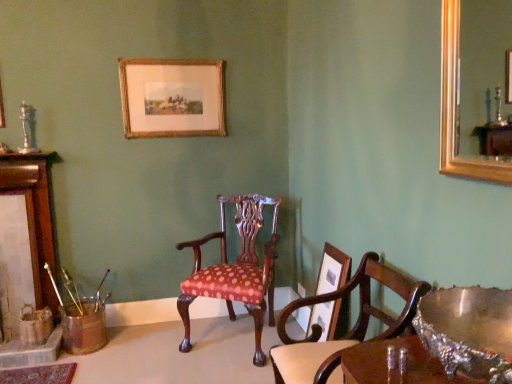
Measure the distance between point (447, 321) and camera.

Point (447, 321) is 3.81 feet from camera.

In order to click on shiny silver bowl at lower right in this screenshot , I will do `click(468, 331)`.

Based on the photo, is polka dot fabric chair at center, which ranks as the 1th chair in back-to-front order, looking in the opposite direction of brushed metal fireplace at left?

No, polka dot fabric chair at center, which ranks as the 1th chair in back-to-front order, is not facing away from brushed metal fireplace at left.

Is polka dot fabric chair at center, the 2th chair from the front, spatially inside brushed metal fireplace at left, or outside of it?

polka dot fabric chair at center, the 2th chair from the front, lies outside brushed metal fireplace at left.

Which is nearer, (186,350) or (27,179)?

Point (186,350) appears to be closer to the viewer than point (27,179).

Find the location of a particular element. glass bowl above the wooden picture frame at center, placed as the first picture frame when sorted from front to back (from the image's perspective) is located at coordinates (468, 331).

From the image's perspective, which is above, wooden picture frame at center, the second picture frame in the top-to-bottom sequence, or shiny silver bowl at lower right?

shiny silver bowl at lower right, from the image's perspective.

Does wooden picture frame at center, the first picture frame from the bottom, contain shiny silver bowl at lower right?

Definitely not — shiny silver bowl at lower right is not inside wooden picture frame at center, the first picture frame from the bottom.

From a real-world perspective, which object rests below the other?

wooden picture frame at center, arranged as the 2th picture frame when viewed from the left, is physically lower.

From a real-world perspective, relative to brushed metal fireplace at left, is polka dot fabric chair at center, which appears as the 1th chair when viewed from the front, vertically above or below?

From a real-world perspective, polka dot fabric chair at center, which appears as the 1th chair when viewed from the front, is physically below brushed metal fireplace at left.

Does point (325, 362) come farther from viewer compared to point (55, 299)?

No, it is in front of (55, 299).

Is polka dot fabric chair at center, which appears as the 1th chair when viewed from the front, directly adjacent to brushed metal fireplace at left?

No, polka dot fabric chair at center, which appears as the 1th chair when viewed from the front, is not beside brushed metal fireplace at left.

Could you tell me if polka dot fabric chair at center, which appears as the 1th chair when viewed from the front, is turned towards brushed metal fireplace at left?

No, polka dot fabric chair at center, which appears as the 1th chair when viewed from the front, is not turned towards brushed metal fireplace at left.

Is point (317, 313) closer to viewer compared to point (375, 255)?

That is False.

Looking at this image, does wooden picture frame at center, which appears as the second picture frame when viewed from the back, have a lesser width compared to polka dot fabric chair at center, which appears as the 1th chair when viewed from the front?

Yes, wooden picture frame at center, which appears as the second picture frame when viewed from the back, is thinner than polka dot fabric chair at center, which appears as the 1th chair when viewed from the front.

Is wooden picture frame at center, placed as the first picture frame when sorted from front to back, aimed at polka dot fabric chair at center, acting as the 2th chair starting from the back?

No, wooden picture frame at center, placed as the first picture frame when sorted from front to back, is not aimed at polka dot fabric chair at center, acting as the 2th chair starting from the back.

Based on the photo, would you say polka dot fabric chair at center, which appears as the 1th chair when viewed from the front, is a long distance from wooden picture frame at center, the second picture frame in the top-to-bottom sequence?

polka dot fabric chair at center, which appears as the 1th chair when viewed from the front, is near wooden picture frame at center, the second picture frame in the top-to-bottom sequence, not far away.

Could you tell me if polka dot fabric chair at center, which appears as the 1th chair when viewed from the front, is turned towards wooden picture frame at center, the second picture frame in the top-to-bottom sequence?

No, polka dot fabric chair at center, which appears as the 1th chair when viewed from the front, is not facing towards wooden picture frame at center, the second picture frame in the top-to-bottom sequence.

In the scene shown: From a real-world perspective, which object rests below the other?

polka dot fabric chair at center, which appears as the 1th chair when viewed from the front, is physically lower.

Between polka dot fabric chair at center, which appears as the 1th chair when viewed from the front, and wooden picture frame at center, arranged as the 2th picture frame when viewed from the left, which one has smaller width?

Thinner between the two is wooden picture frame at center, arranged as the 2th picture frame when viewed from the left.

Which of these two, polka dot fabric chair at center, which ranks as the 1th chair in back-to-front order, or gold-framed print at upper center, the second picture frame viewed from the right, is thinner?

gold-framed print at upper center, the second picture frame viewed from the right, is thinner.

Which is correct: polka dot fabric chair at center, which ranks as the 1th chair in back-to-front order, is inside gold-framed print at upper center, which is counted as the 1th picture frame, starting from the top, or outside of it?

polka dot fabric chair at center, which ranks as the 1th chair in back-to-front order, exists outside the volume of gold-framed print at upper center, which is counted as the 1th picture frame, starting from the top.

What's the angular difference between polka dot fabric chair at center, which ranks as the 1th chair in back-to-front order, and gold-framed print at upper center, which appears as the 2th picture frame when viewed from the front,'s facing directions?

The facing directions of polka dot fabric chair at center, which ranks as the 1th chair in back-to-front order, and gold-framed print at upper center, which appears as the 2th picture frame when viewed from the front, are 32.2 degrees apart.

From the image's perspective, is polka dot fabric chair at center, the 2th chair from the front, under gold-framed print at upper center, marked as the first picture frame in a left-to-right arrangement?

Yes, from the image's perspective, polka dot fabric chair at center, the 2th chair from the front, is below gold-framed print at upper center, marked as the first picture frame in a left-to-right arrangement.

Considering the sizes of polka dot fabric chair at center, acting as the 2th chair starting from the back, and polka dot fabric chair at center, which ranks as the 1th chair in back-to-front order, in the image, is polka dot fabric chair at center, acting as the 2th chair starting from the back, bigger or smaller than polka dot fabric chair at center, which ranks as the 1th chair in back-to-front order,?

Considering their sizes, polka dot fabric chair at center, acting as the 2th chair starting from the back, takes up less space than polka dot fabric chair at center, which ranks as the 1th chair in back-to-front order.

From a real-world perspective, is polka dot fabric chair at center, which appears as the 1th chair when viewed from the front, physically located above or below polka dot fabric chair at center, the 2th chair from the front?

From a real-world perspective, polka dot fabric chair at center, which appears as the 1th chair when viewed from the front, is physically above polka dot fabric chair at center, the 2th chair from the front.

From the image's perspective, does polka dot fabric chair at center, which appears as the 1th chair when viewed from the front, appear lower than polka dot fabric chair at center, the 2th chair from the front?

Indeed, from the image's perspective, polka dot fabric chair at center, which appears as the 1th chair when viewed from the front, is shown beneath polka dot fabric chair at center, the 2th chair from the front.

How many degrees apart are the facing directions of polka dot fabric chair at center, acting as the 2th chair starting from the back, and polka dot fabric chair at center, which ranks as the 1th chair in back-to-front order?

The angle between the facing direction of polka dot fabric chair at center, acting as the 2th chair starting from the back, and the facing direction of polka dot fabric chair at center, which ranks as the 1th chair in back-to-front order, is 58.4 degrees.

Locate an element on the screen. This screenshot has height=384, width=512. fireplace that appears above the polka dot fabric chair at center, the 2th chair from the front (from the image's perspective) is located at coordinates (26, 252).

Image resolution: width=512 pixels, height=384 pixels. Identify the location of glass bowl that appears above the wooden picture frame at center, the first picture frame from the bottom (from a real-world perspective). [468, 331].

Estimate the real-world distances between objects in this image. Which object is further from polka dot fabric chair at center, the 2th chair from the front, wooden picture frame at center, placed as the first picture frame when sorted from front to back, or brushed metal fireplace at left?

Based on the image, brushed metal fireplace at left appears to be further to polka dot fabric chair at center, the 2th chair from the front.

Estimate the real-world distances between objects in this image. Which object is further from shiny silver bowl at lower right, wooden picture frame at center, arranged as the 2th picture frame when viewed from the left, or gold-framed print at upper center, positioned as the second picture frame in bottom-to-top order?

Based on the image, gold-framed print at upper center, positioned as the second picture frame in bottom-to-top order, appears to be further to shiny silver bowl at lower right.

Estimate the real-world distances between objects in this image. Which object is closer to shiny silver bowl at lower right, brushed metal fireplace at left or gold-framed print at upper center, marked as the first picture frame in a left-to-right arrangement?

gold-framed print at upper center, marked as the first picture frame in a left-to-right arrangement, is closer to shiny silver bowl at lower right.

Which object lies further to the anchor point wooden picture frame at center, which appears as the second picture frame when viewed from the back, gold-framed print at upper center, the second picture frame viewed from the right, or polka dot fabric chair at center, the 2th chair from the front?

gold-framed print at upper center, the second picture frame viewed from the right, is positioned further to the anchor wooden picture frame at center, which appears as the second picture frame when viewed from the back.

From the image, which object appears to be nearer to polka dot fabric chair at center, acting as the 2th chair starting from the back, polka dot fabric chair at center, which ranks as the 1th chair in back-to-front order, or brushed metal fireplace at left?

The object closer to polka dot fabric chair at center, acting as the 2th chair starting from the back, is polka dot fabric chair at center, which ranks as the 1th chair in back-to-front order.

Based on their spatial positions, is gold-framed print at upper center, positioned as the second picture frame in bottom-to-top order, or shiny silver bowl at lower right closer to polka dot fabric chair at center, the 2th chair from the front?

gold-framed print at upper center, positioned as the second picture frame in bottom-to-top order, lies closer to polka dot fabric chair at center, the 2th chair from the front, than the other object.

From the image, which object appears to be nearer to gold-framed print at upper center, the second picture frame viewed from the right, brushed metal fireplace at left or shiny silver bowl at lower right?

brushed metal fireplace at left is closer to gold-framed print at upper center, the second picture frame viewed from the right.

When comparing their distances from gold-framed print at upper center, the second picture frame viewed from the right, does polka dot fabric chair at center, the 2th chair from the front, or polka dot fabric chair at center, acting as the 2th chair starting from the back, seem further?

polka dot fabric chair at center, acting as the 2th chair starting from the back, is positioned further to the anchor gold-framed print at upper center, the second picture frame viewed from the right.

At what (x,y) coordinates should I click in order to perform the action: click on picture frame between polka dot fabric chair at center, acting as the 2th chair starting from the back, and gold-framed print at upper center, marked as the first picture frame in a left-to-right arrangement, along the z-axis. Please return your answer as a coordinate pair (x, y). Looking at the image, I should click on (330, 318).

The height and width of the screenshot is (384, 512). In order to click on picture frame between brushed metal fireplace at left and polka dot fabric chair at center, which ranks as the 1th chair in back-to-front order, in the horizontal direction in this screenshot , I will do `click(172, 97)`.

Find the location of a particular element. The image size is (512, 384). picture frame between polka dot fabric chair at center, which appears as the 1th chair when viewed from the front, and polka dot fabric chair at center, which ranks as the 1th chair in back-to-front order, from front to back is located at coordinates (330, 318).

At what (x,y) coordinates should I click in order to perform the action: click on picture frame between shiny silver bowl at lower right and gold-framed print at upper center, which is counted as the 1th picture frame, starting from the top, from front to back. Please return your answer as a coordinate pair (x, y). Looking at the image, I should click on coord(330,318).